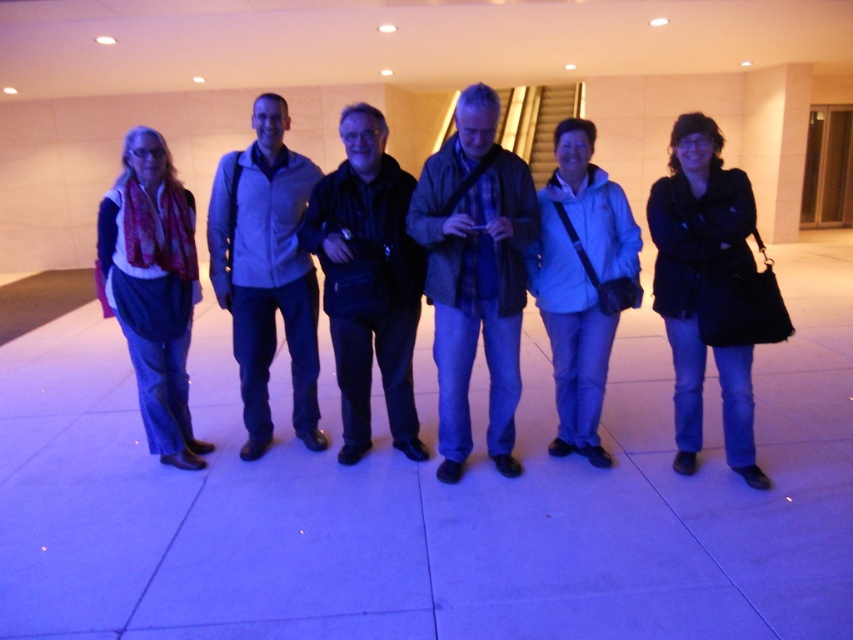
You are a photographer trying to capture a group photo of the blue plaid shirt at center and the dark blue leather jacket at center. The minimum distance your camera can focus on two subjects is 12 inches. Will you be able to take a clear photo of both subjects at the same time?

The blue plaid shirt at center and dark blue leather jacket at center are 11.67 inches apart from each other. Since the minimum focusing distance is 12 inches, the camera cannot focus on both subjects simultaneously because the distance between them is less than the required minimum.

You are a photographer trying to capture a clear shot of the dark blue leather jacket at center and the white matte jacket at center. Since you want both jackets to be in focus, which one should you aim the camera at first?

You should aim the camera at the dark blue leather jacket at center first because it is positioned closer to the camera than the white matte jacket at center, ensuring both will be in focus when focusing on the closer object first.

You are a photographer trying to capture a group photo of the dark blue leather jacket at center and the white matte jacket at center. The minimum distance your camera can focus on two objects is 28 inches. Will you be able to take a clear photo of both jackets at the same time?

The dark blue leather jacket at center and white matte jacket at center are 28.29 inches apart from each other. Since the minimum focus distance is 28 inches, the camera can focus on both jackets as the distance between them is slightly more than the required minimum.